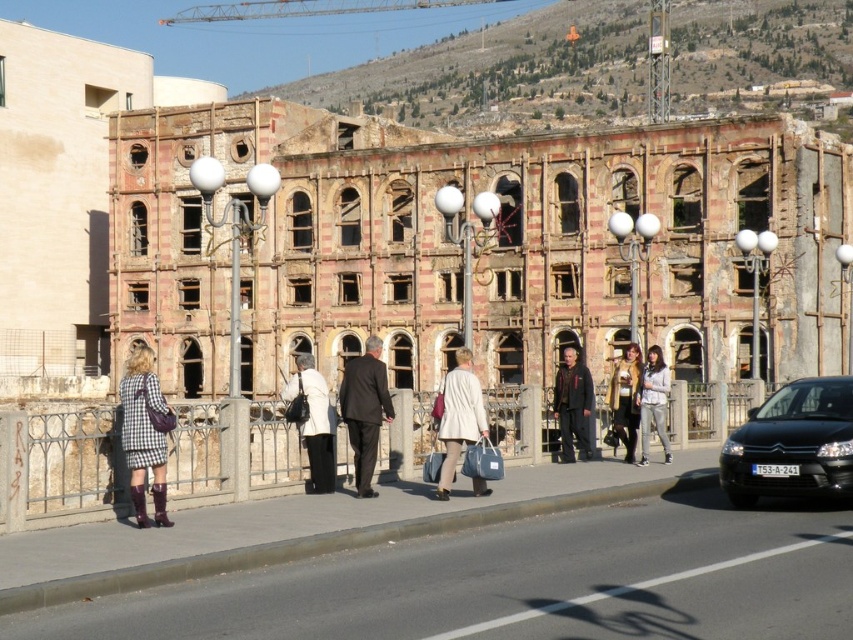
Does point (320, 396) lie in front of point (572, 429)?

Yes, point (320, 396) is closer to viewer.

Is the position of white matte coat at center less distant than that of dark brown leather coat at center?

Yes.

In order to click on white matte coat at center in this screenshot , I will do `click(312, 422)`.

Where is `white matte coat at center`? The width and height of the screenshot is (853, 640). white matte coat at center is located at coordinates pos(312,422).

Between point (405, 448) and point (351, 378), which one is positioned in front?

Point (351, 378)

Does stone textured fence at center appear on the right side of dark brown suit at center?

No, stone textured fence at center is not to the right of dark brown suit at center.

Which is behind, point (218, 422) or point (358, 460)?

The point (358, 460) is behind.

This screenshot has height=640, width=853. I want to click on stone textured fence at center, so click(x=59, y=467).

Can you confirm if black matte car at right is thinner than light gray fabric jacket at center?

Correct, black matte car at right's width is less than light gray fabric jacket at center's.

Between point (766, 456) and point (662, 394), which one is positioned in front?

Point (766, 456) is in front.

At what (x,y) coordinates should I click in order to perform the action: click on black matte car at right. Please return your answer as a coordinate pair (x, y). This screenshot has height=640, width=853. Looking at the image, I should click on (792, 444).